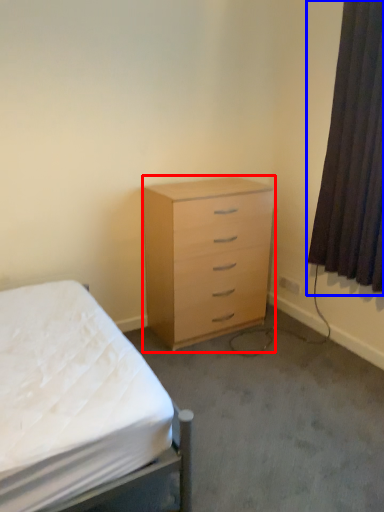
Question: Among these objects, which one is farthest to the camera, chest of drawers (highlighted by a red box) or curtain (highlighted by a blue box)?

Choices:
 (A) chest of drawers
 (B) curtain

Answer: (A)